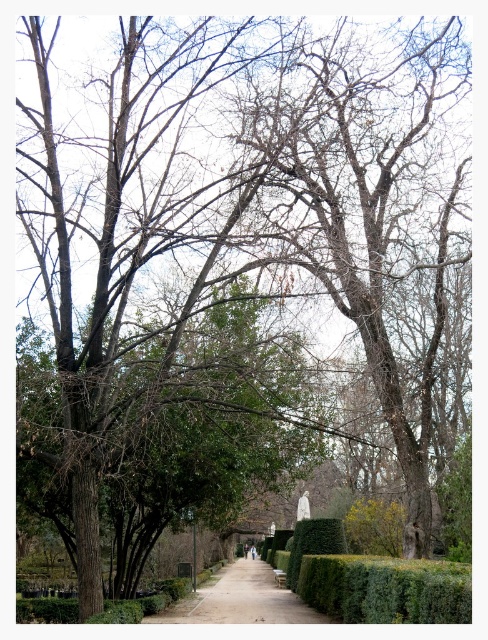
Does green leafy hedge at center appear over paved stone path at center?

Yes, green leafy hedge at center is above paved stone path at center.

Is green leafy hedge at center to the left of paved stone path at center from the viewer's perspective?

Incorrect, green leafy hedge at center is not on the left side of paved stone path at center.

Between point (351, 593) and point (222, 612), which one is positioned behind?

Point (222, 612)

Locate an element on the screen. The height and width of the screenshot is (640, 488). green leafy hedge at center is located at coordinates (386, 589).